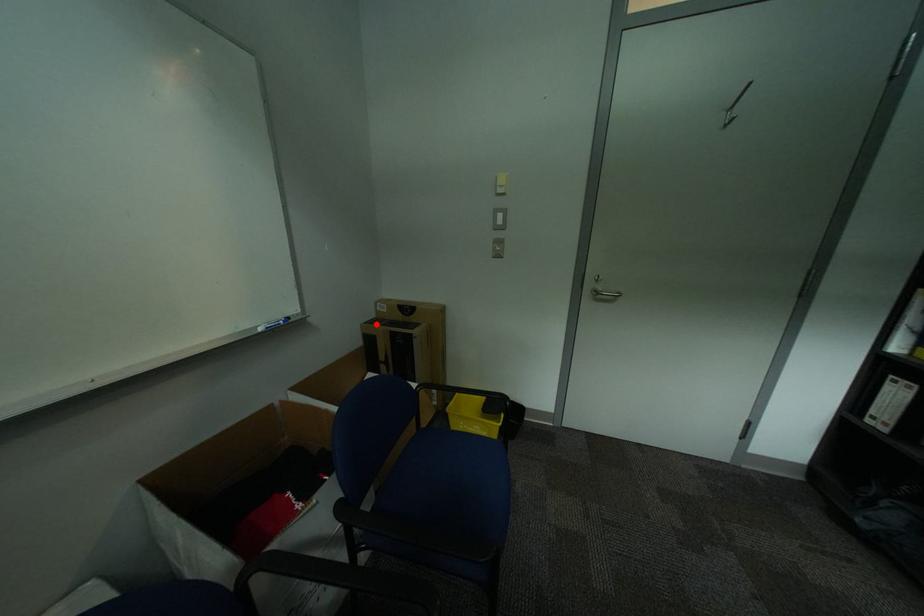
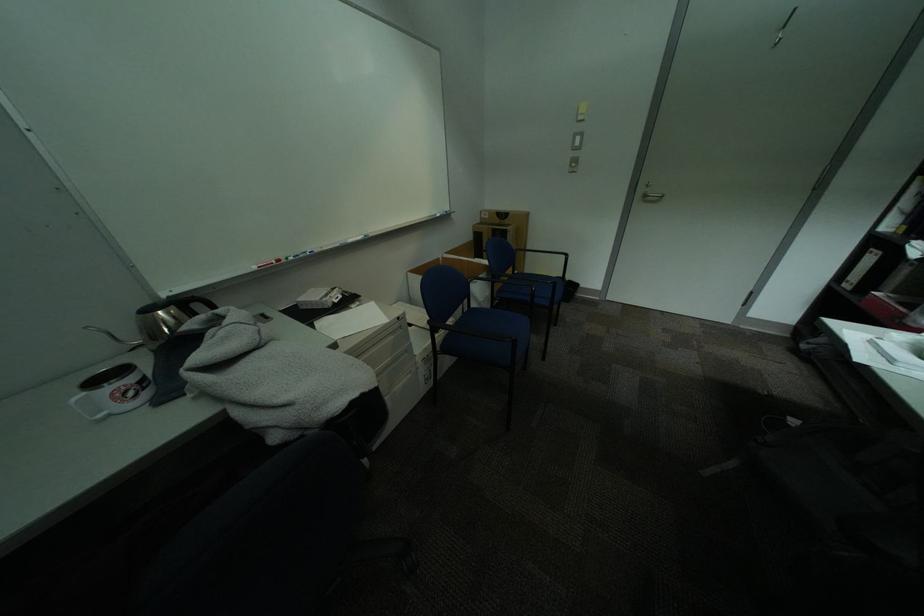
Question: I am providing you with two images of the same scene from different viewpoints. A red point is shown in image1. For the corresponding object point in image2, is it positioned nearer or farther from the camera?

Choices:
 (A) Nearer
 (B) Farther

Answer: (A)